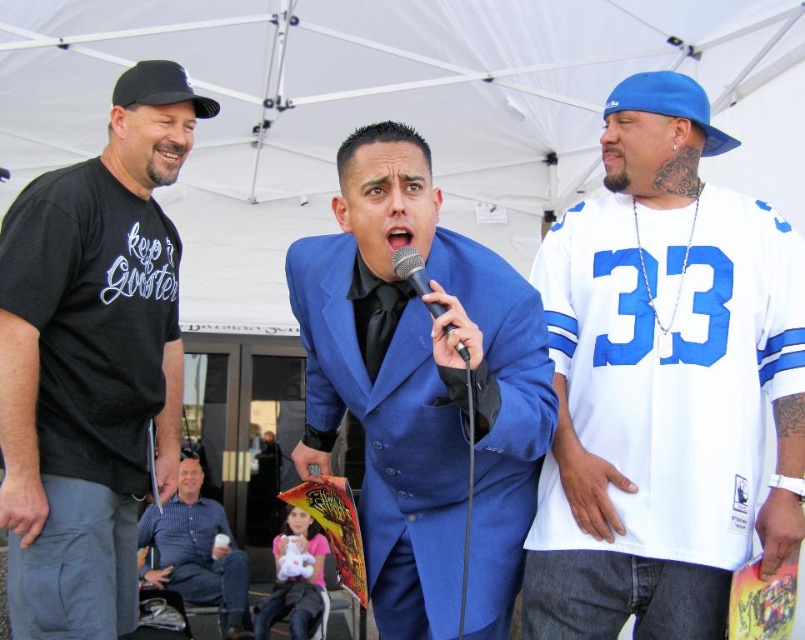
Can you confirm if white jersey at right is shorter than blue striped shirt at lower left?

No.

Is point (564, 257) farther from camera compared to point (223, 586)?

No, (564, 257) is in front of (223, 586).

Locate an element on the screen. The width and height of the screenshot is (805, 640). white jersey at right is located at coordinates (663, 384).

Is the position of black t-shirt at left less distant than that of black fabric baseball cap at upper left?

Yes, black t-shirt at left is closer to the viewer.

Can you confirm if black t-shirt at left is wider than black fabric baseball cap at upper left?

Yes, black t-shirt at left is wider than black fabric baseball cap at upper left.

Between point (77, 580) and point (122, 100), which one is positioned behind?

The point (122, 100) is behind.

Locate an element on the screen. black t-shirt at left is located at coordinates (91, 362).

Can you confirm if black t-shirt at left is positioned to the left of black metallic microphone at center?

Yes, black t-shirt at left is to the left of black metallic microphone at center.

Between black t-shirt at left and black metallic microphone at center, which one is positioned lower?

Positioned lower is black t-shirt at left.

Measure the distance between black t-shirt at left and camera.

black t-shirt at left is 3.30 meters away from camera.

At what (x,y) coordinates should I click in order to perform the action: click on black t-shirt at left. Please return your answer as a coordinate pair (x, y). The image size is (805, 640). Looking at the image, I should click on (91, 362).